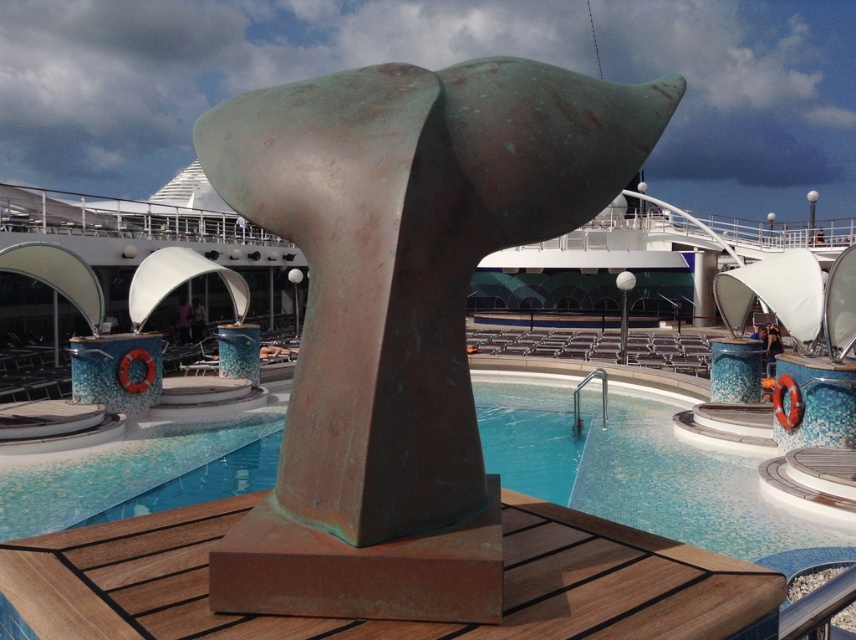
Question: Which object appears closest to the camera in this image?

Choices:
 (A) green patina sculpture at center
 (B) rustic wood deck at center

Answer: (B)

Question: Which point is closer to the camera?

Choices:
 (A) green patina sculpture at center
 (B) rustic wood deck at center

Answer: (B)

Question: Which point is closer to the camera?

Choices:
 (A) (617, 612)
 (B) (391, 378)

Answer: (A)

Question: Considering the relative positions of green patina sculpture at center and rustic wood deck at center in the image provided, where is green patina sculpture at center located with respect to rustic wood deck at center?

Choices:
 (A) below
 (B) above

Answer: (B)

Question: Is green patina sculpture at center closer to camera compared to rustic wood deck at center?

Choices:
 (A) no
 (B) yes

Answer: (A)

Question: Does green patina sculpture at center lie behind rustic wood deck at center?

Choices:
 (A) no
 (B) yes

Answer: (B)